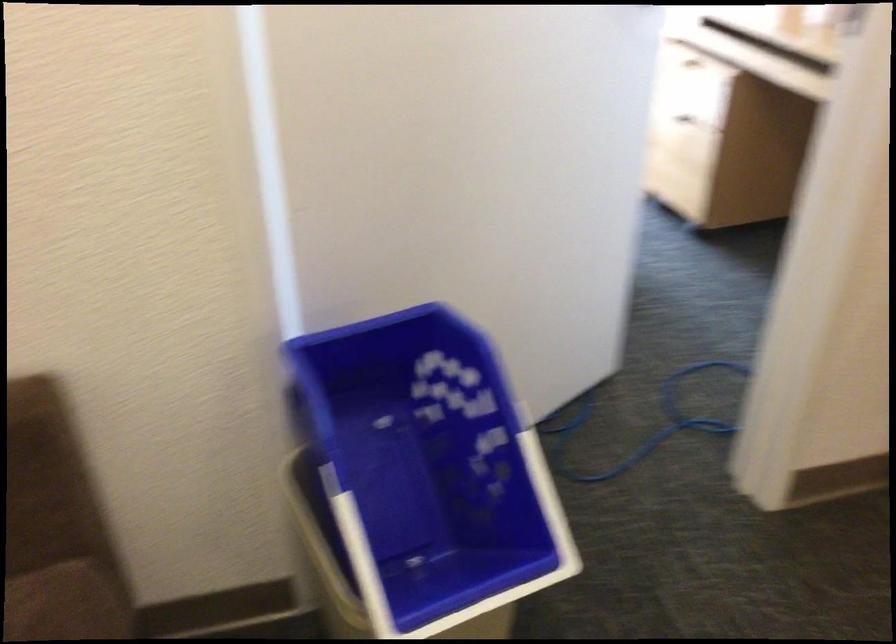
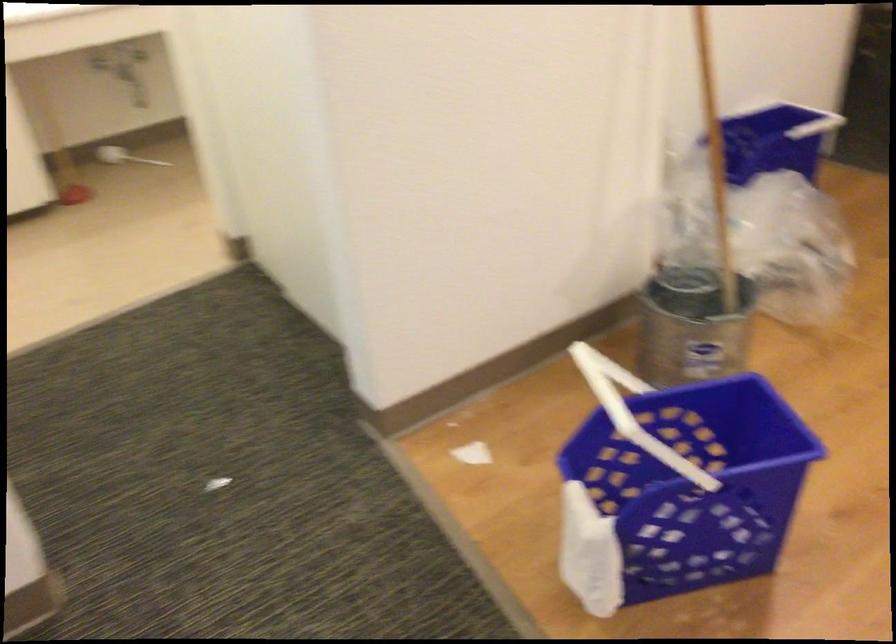
From the picture: First-person continuous shooting, in which direction is the camera rotating?

The camera's rotation is toward right-down.